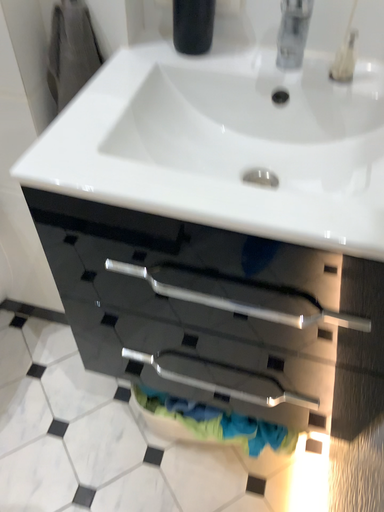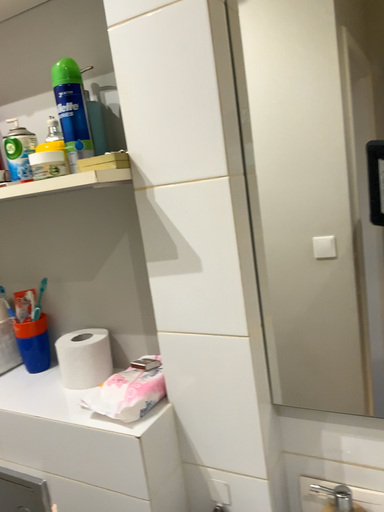
Question: Which way did the camera rotate in the video?

Choices:
 (A) rotated downward
 (B) rotated upward

Answer: (B)